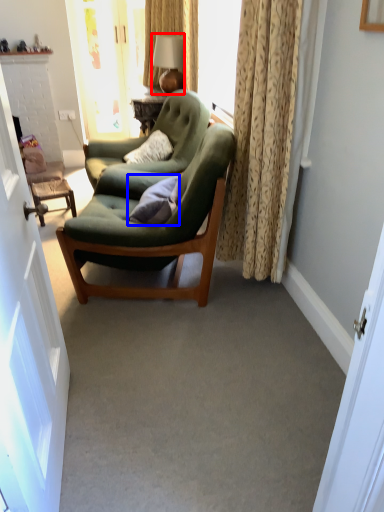
Question: Which object appears farthest to the camera in this image, lamp (highlighted by a red box) or pillow (highlighted by a blue box)?

Choices:
 (A) lamp
 (B) pillow

Answer: (A)